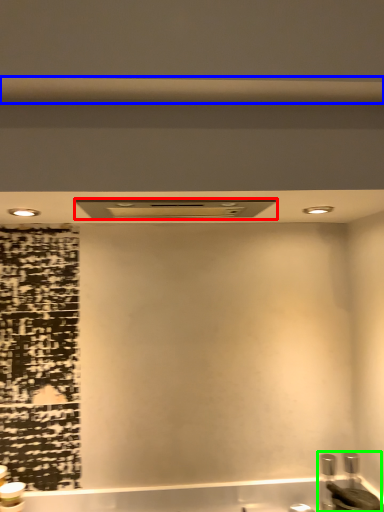
Question: Which object is the closest to the exhaust hood (highlighted by a red box)? Choose among these: beam (highlighted by a blue box) or sink (highlighted by a green box).

Choices:
 (A) beam
 (B) sink

Answer: (A)